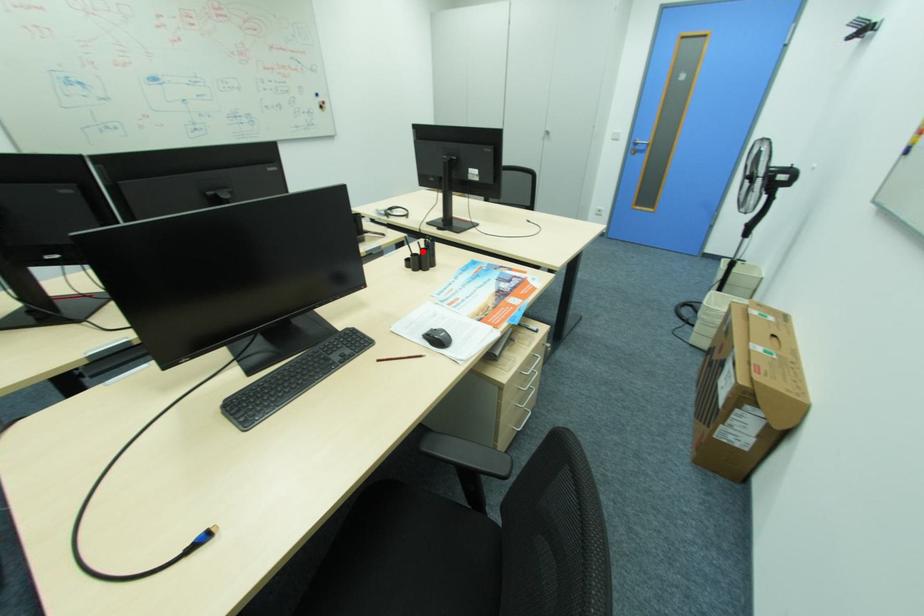
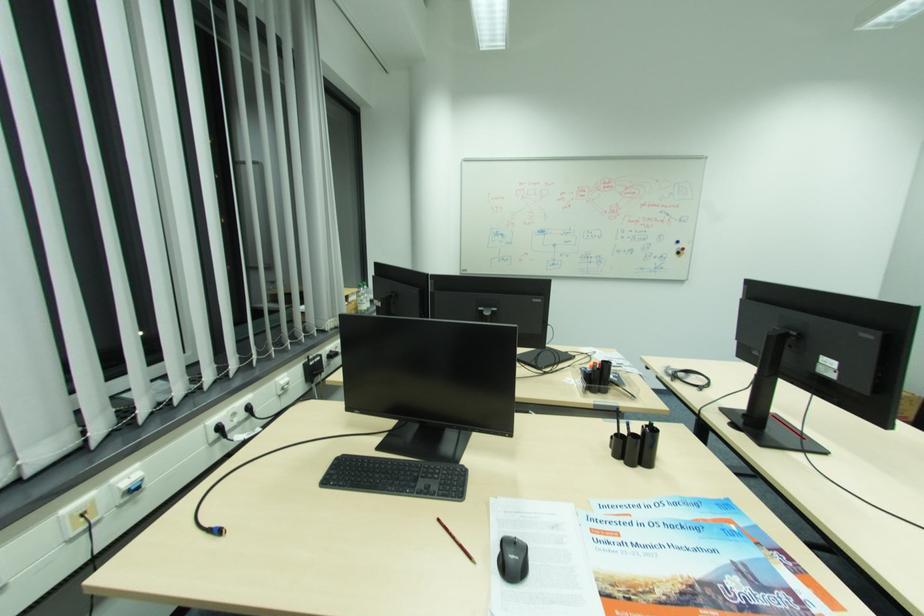
Locate, in the second image, the point that corresponds to the highlighted location in the first image.

(631, 434)